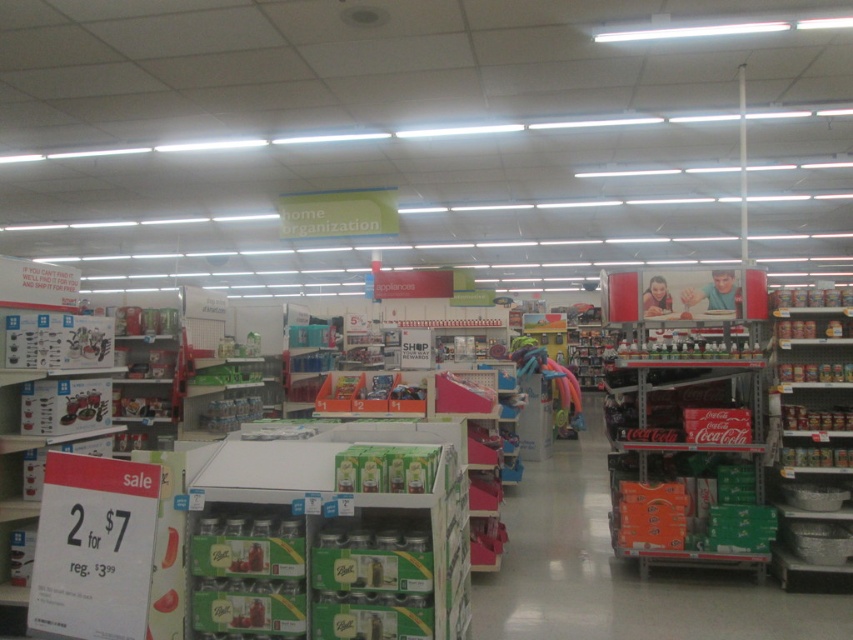
You are a customer in the store and want to reach both the point at [254,502] and the point at [798,381]. Which point should you go to first to minimize the distance walked?

You should go to point [254,502] first because it is in front of point [798,381], so reaching it first would minimize the distance walked.

You are a customer in the store and you need to reach an item on the top shelf. You see the green cardboard boxes at center and the metallic silver bowls at right. Which object is shorter so you can step on it to reach the item?

The green cardboard boxes at center is not as tall as metallic silver bowls at right, so you can step on the green cardboard boxes at center to reach the item.